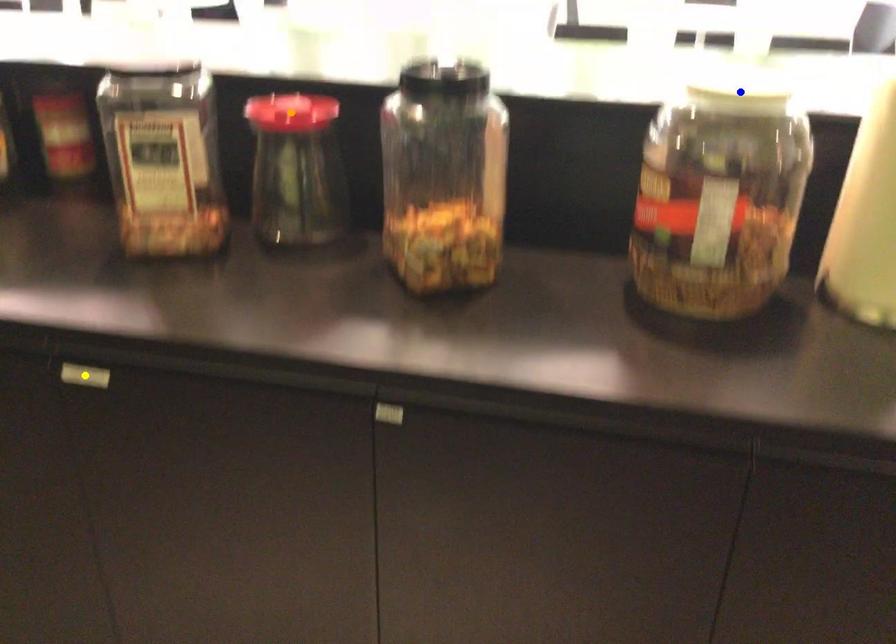
Order these from nearest to farthest:
blue point | orange point | yellow point

orange point, yellow point, blue point